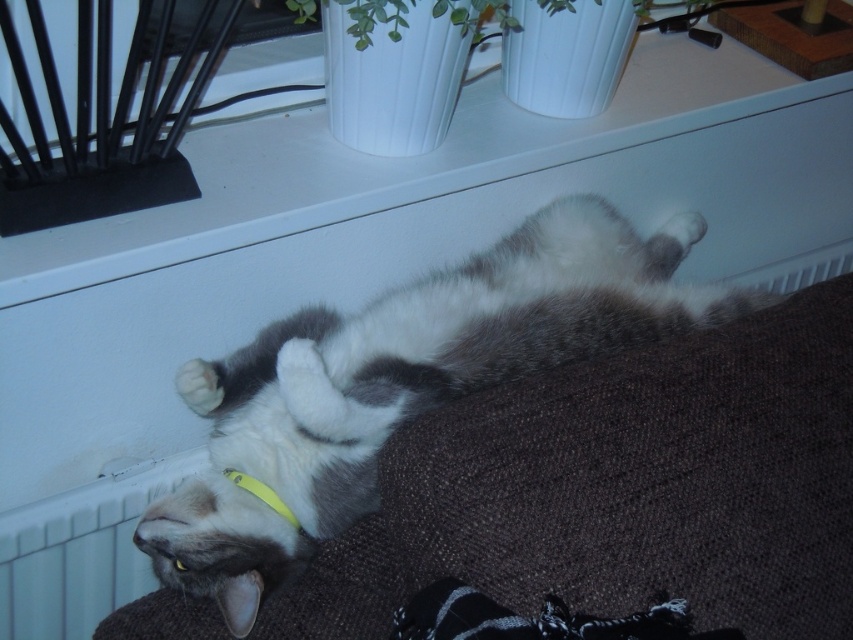
Based on the coordinates provided, which object in the scene is located at point (402, 385)?

The gray fur cat at center is located at point (402, 385).

You are a pet sitter observing the gray fur cat at center and the yellow fabric neckband at lower center. Which object is taller?

The gray fur cat at center is taller than the yellow fabric neckband at lower center.

You are a photographer trying to capture a closeup of the gray fur cat at center and the yellow fabric neckband at lower center. Which object should you focus on first to ensure both are in sharp focus?

The gray fur cat at center is closer to the viewer than the yellow fabric neckband at lower center. To ensure both are in sharp focus, you should focus on the gray fur cat at center first, as it is the closer object.